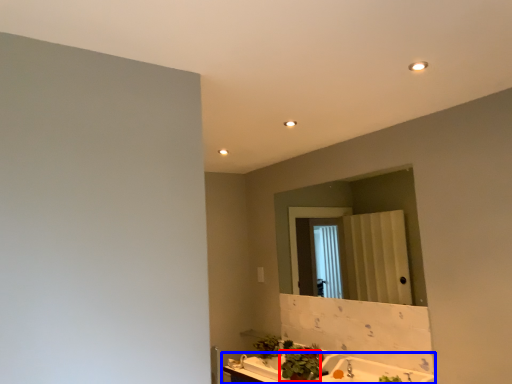
Question: Which object is closer to the camera taking this photo, plant (highlighted by a red box) or counter top (highlighted by a blue box)?

Choices:
 (A) plant
 (B) counter top

Answer: (B)